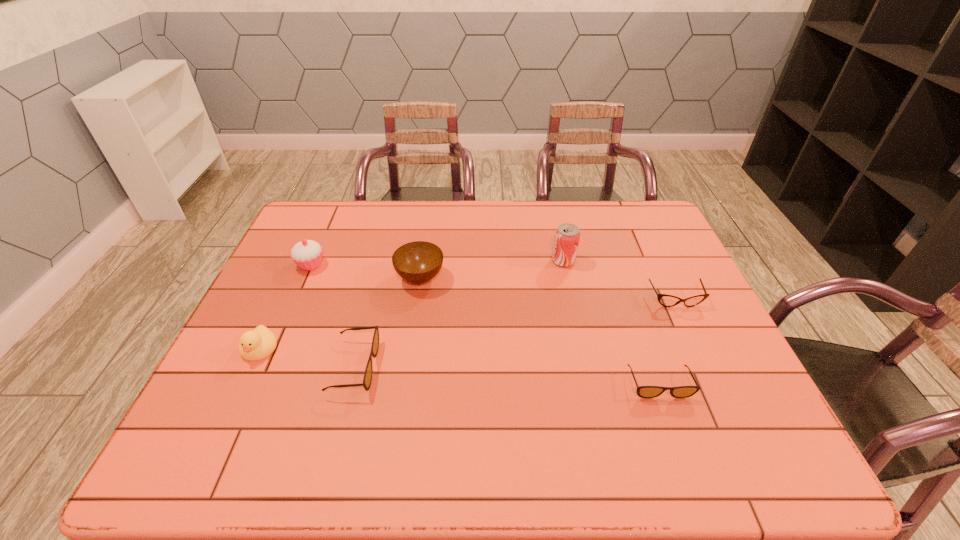
I want to click on vacant space located on the front-facing side of the spectacles, so click(x=718, y=391).

Locate an element on the screen. Image resolution: width=960 pixels, height=540 pixels. vacant region located on the right of the third object from right to left is located at coordinates (650, 261).

You are a GUI agent. You are given a task and a screenshot of the screen. Output one action in this format:
    pyautogui.click(x=<x>, y=<y>)
    Task: Click on the vacant space situated 0.340m on the back of the fourth object from left to right
    This screenshot has width=960, height=540.
    Given the screenshot: What is the action you would take?
    432,202

The image size is (960, 540). Find the location of `free space located 0.100m on the face of the duckling`. free space located 0.100m on the face of the duckling is located at coordinates (235, 401).

You are a GUI agent. You are given a task and a screenshot of the screen. Output one action in this format:
    pyautogui.click(x=<x>, y=<y>)
    Task: Click on the vacant space located 0.090m on the back of the cupcake
    This screenshot has height=540, width=960.
    Given the screenshot: What is the action you would take?
    pyautogui.click(x=323, y=238)

Image resolution: width=960 pixels, height=540 pixels. I want to click on duckling that is at the left edge, so click(x=254, y=345).

Locate an element on the screen. The width and height of the screenshot is (960, 540). cupcake positioned at the left edge is located at coordinates (307, 254).

Identify the location of sunglasses positioned at the right edge. (642, 391).

In order to click on spectacles that is at the right edge in this screenshot , I will do `click(665, 300)`.

What are the coordinates of `object located in the near right corner section of the desktop` in the screenshot? It's located at (642, 391).